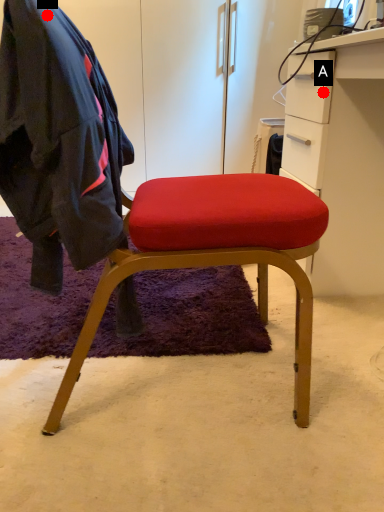
Question: Two points are circled on the image, labeled by A and B beside each circle. Which point is closer to the camera taking this photo?

Choices:
 (A) A is closer
 (B) B is closer

Answer: (B)